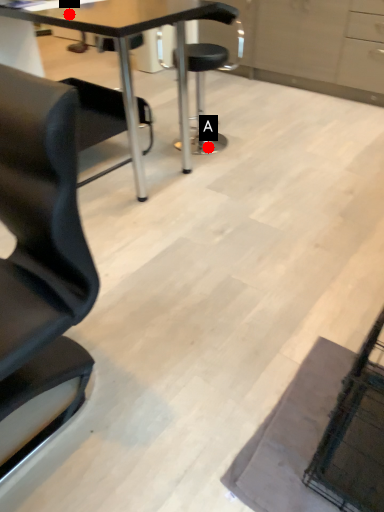
Question: Two points are circled on the image, labeled by A and B beside each circle. Which point appears farthest from the camera in this image?

Choices:
 (A) A is further
 (B) B is further

Answer: (A)